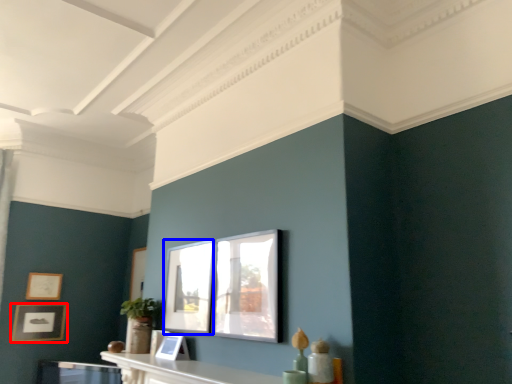
Question: Among these objects, which one is farthest to the camera, picture frame (highlighted by a red box) or window (highlighted by a blue box)?

Choices:
 (A) picture frame
 (B) window

Answer: (A)